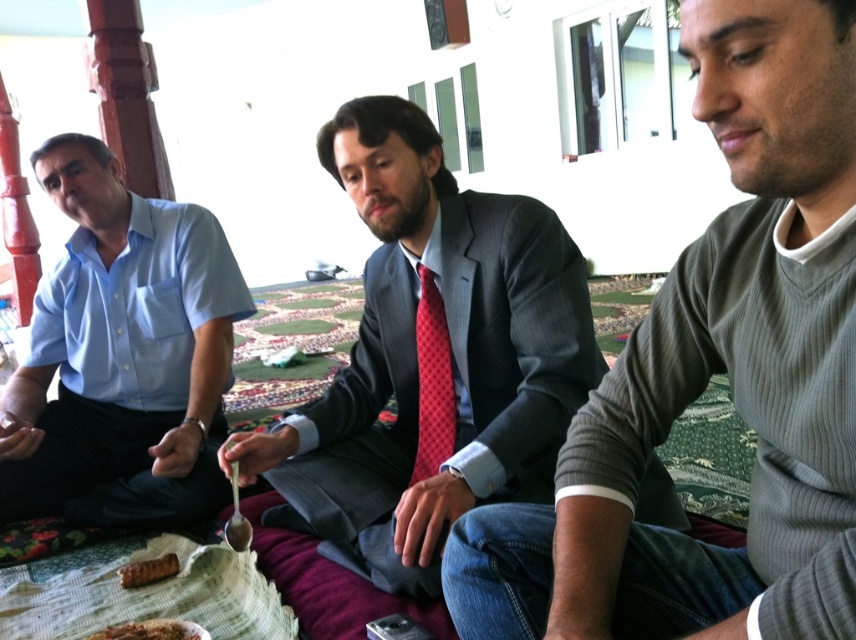
Question: Does red dotted tie at center appear on the left side of brown crumbly bread at lower left?

Choices:
 (A) yes
 (B) no

Answer: (B)

Question: From the image, what is the correct spatial relationship of gray ribbed sweater at center in relation to red dotted tie at center?

Choices:
 (A) right
 (B) left

Answer: (A)

Question: Among these objects, which one is nearest to the camera?

Choices:
 (A) light blue cotton shirt at left
 (B) gray ribbed sweater at center
 (C) matte gray suit at center
 (D) brown crumbly bread at lower left

Answer: (B)

Question: Which point is closer to the camera?

Choices:
 (A) (141, 568)
 (B) (421, 448)
 (C) (580, 429)

Answer: (C)

Question: Is light blue cotton shirt at left smaller than brown crumbly bread at lower left?

Choices:
 (A) no
 (B) yes

Answer: (A)

Question: Considering the real-world distances, which object is closest to the brown crumbly bread at lower left?

Choices:
 (A) gray ribbed sweater at center
 (B) brown crispy pastry at lower left
 (C) matte gray suit at center

Answer: (B)